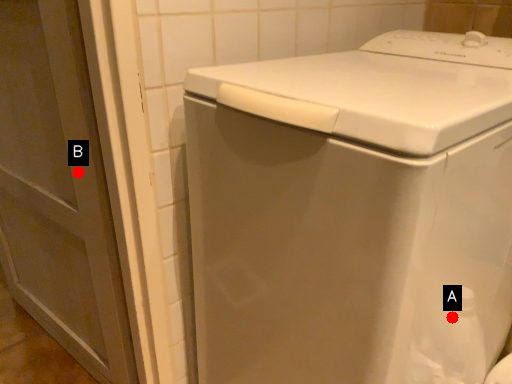
Question: Two points are circled on the image, labeled by A and B beside each circle. Which of the following is the closest to the observer?

Choices:
 (A) A is closer
 (B) B is closer

Answer: (A)